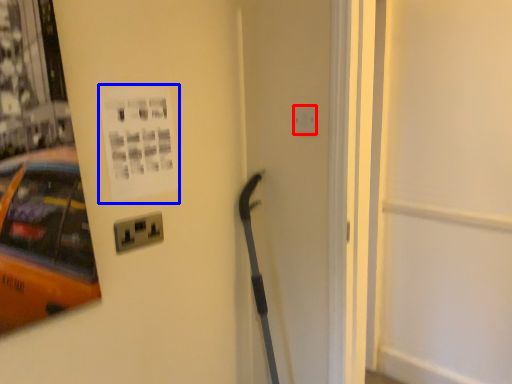
Question: Which of the following is the farthest to the observer, electric outlet (highlighted by a red box) or poster page (highlighted by a blue box)?

Choices:
 (A) electric outlet
 (B) poster page

Answer: (A)